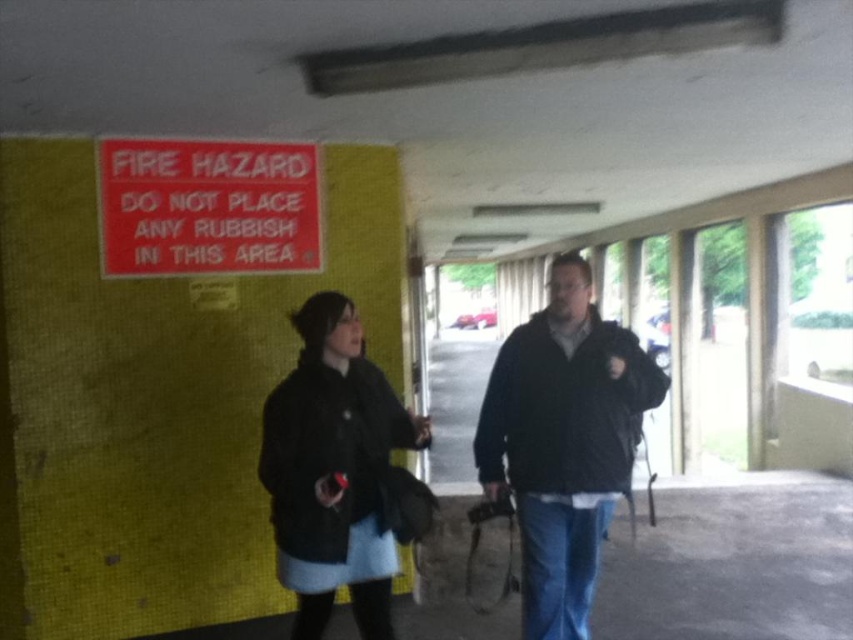
Question: Which object is positioned closest to the black textured coat at center?

Choices:
 (A) matte black jacket at center
 (B) dark gray jacket at center
 (C) red plastic sign at upper left

Answer: (B)

Question: Which point appears farthest from the camera in this image?

Choices:
 (A) (322, 440)
 (B) (207, 246)
 (C) (535, 422)
 (D) (538, 474)

Answer: (B)

Question: Is dark gray jacket at center positioned behind matte black jacket at center?

Choices:
 (A) yes
 (B) no

Answer: (B)

Question: Can you confirm if black textured coat at center is positioned below red plastic sign at upper left?

Choices:
 (A) no
 (B) yes

Answer: (B)

Question: Observing the image, what is the correct spatial positioning of matte black jacket at center in reference to red plastic sign at upper left?

Choices:
 (A) left
 (B) right

Answer: (B)

Question: Which object is closer to the camera taking this photo?

Choices:
 (A) dark gray jacket at center
 (B) red plastic sign at upper left
 (C) matte black jacket at center
 (D) black textured coat at center

Answer: (D)